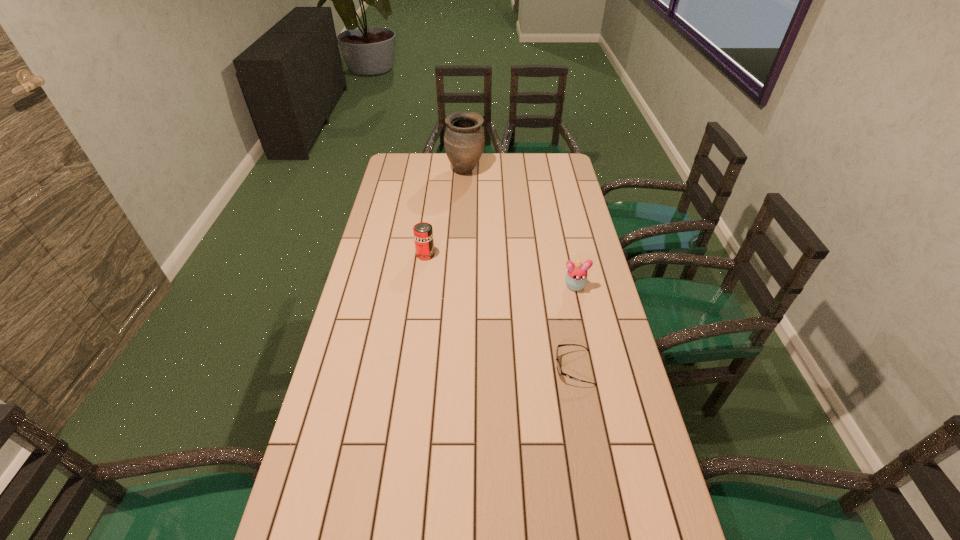
Identify the location of the third object from right to left. The image size is (960, 540). (464, 140).

Locate an element on the screen. This screenshot has width=960, height=540. the tallest object is located at coordinates [x=464, y=140].

At what (x,y) coordinates should I click in order to perform the action: click on the leftmost object. Please return your answer as a coordinate pair (x, y). This screenshot has height=540, width=960. Looking at the image, I should click on (423, 232).

Locate an element on the screen. The width and height of the screenshot is (960, 540). the third nearest object is located at coordinates (423, 232).

Locate an element on the screen. cupcake is located at coordinates (576, 278).

Identify the location of the shortest object. (560, 372).

Image resolution: width=960 pixels, height=540 pixels. I want to click on sunglasses, so click(560, 372).

Find the location of a particular element. Image resolution: width=960 pixels, height=540 pixels. free space located 0.050m on the left of the urn is located at coordinates (435, 171).

Locate an element on the screen. This screenshot has height=540, width=960. free space located 0.350m on the right of the can is located at coordinates (529, 255).

Find the location of a particular element. The image size is (960, 540). vacant region located 0.350m on the face of the third farthest object is located at coordinates 595,382.